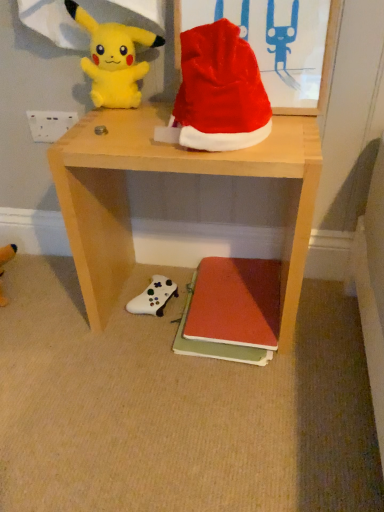
Find the location of `free space to the left of white matte game controller at lower center, acting as the first toy starting from the back`. free space to the left of white matte game controller at lower center, acting as the first toy starting from the back is located at coordinates (105, 308).